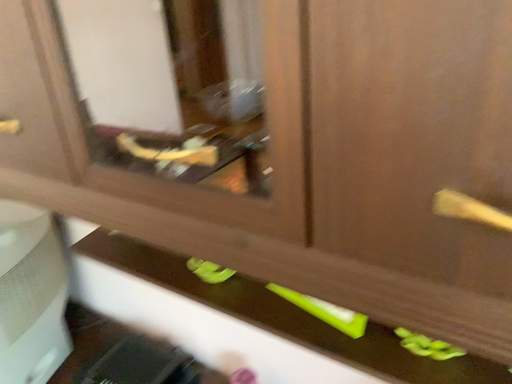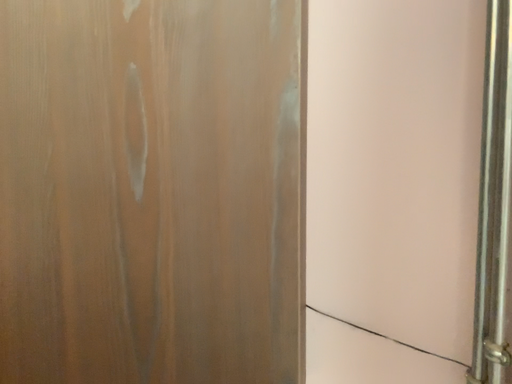
Question: Which way did the camera rotate in the video?

Choices:
 (A) rotated downward
 (B) rotated upward

Answer: (B)